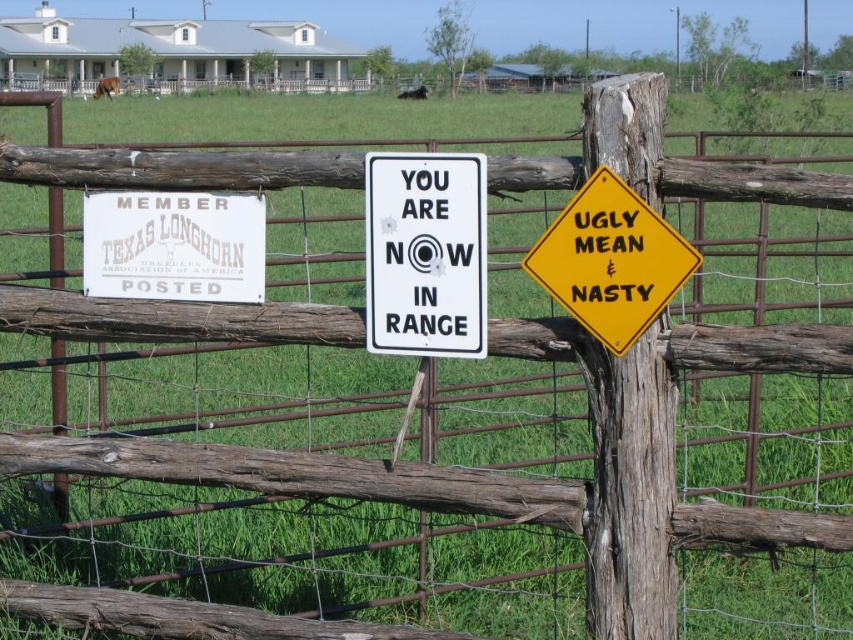
Does white matte sign at upper left have a larger size compared to yellow diamond-shaped sign at upper right?

No, white matte sign at upper left is not bigger than yellow diamond-shaped sign at upper right.

Which is more to the right, white matte sign at upper left or yellow diamond-shaped sign at upper right?

yellow diamond-shaped sign at upper right

Where is `white matte sign at upper left`? white matte sign at upper left is located at coordinates (173, 244).

Is white paper sign at center wider than yellow diamond-shaped sign at upper right?

No.

Identify the location of white paper sign at center. (425, 253).

Does white paper sign at center appear on the left side of white matte sign at upper left?

Incorrect, white paper sign at center is not on the left side of white matte sign at upper left.

Consider the image. Can you confirm if white paper sign at center is smaller than white matte sign at upper left?

No, white paper sign at center is not smaller than white matte sign at upper left.

This screenshot has height=640, width=853. What do you see at coordinates (425, 253) in the screenshot?
I see `white paper sign at center` at bounding box center [425, 253].

At what (x,y) coordinates should I click in order to perform the action: click on white paper sign at center. Please return your answer as a coordinate pair (x, y). Looking at the image, I should click on (425, 253).